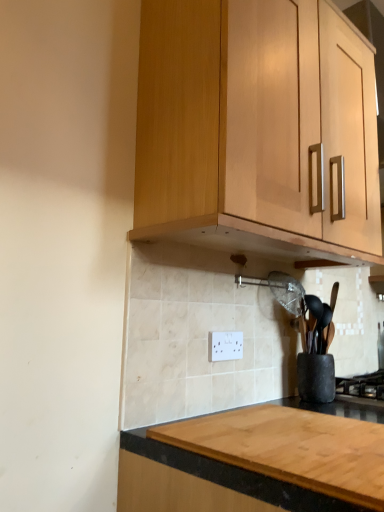
Question: Is light wood cabinet at upper center beside white plastic electric outlet at center?

Choices:
 (A) no
 (B) yes

Answer: (A)

Question: Is light wood cabinet at upper center aimed at white plastic electric outlet at center?

Choices:
 (A) no
 (B) yes

Answer: (A)

Question: Is light wood cabinet at upper center facing away from white plastic electric outlet at center?

Choices:
 (A) yes
 (B) no

Answer: (B)

Question: From a real-world perspective, does light wood cabinet at upper center sit lower than white plastic electric outlet at center?

Choices:
 (A) no
 (B) yes

Answer: (A)

Question: Considering the relative sizes of light wood cabinet at upper center and white plastic electric outlet at center in the image provided, is light wood cabinet at upper center wider than white plastic electric outlet at center?

Choices:
 (A) no
 (B) yes

Answer: (B)

Question: Is light wood cabinet at upper center positioned in front of white plastic electric outlet at center?

Choices:
 (A) yes
 (B) no

Answer: (A)

Question: Can you confirm if black granite countertop at lower center is shorter than light wood cabinet at upper center?

Choices:
 (A) yes
 (B) no

Answer: (A)

Question: Is black granite countertop at lower center to the right of light wood cabinet at upper center from the viewer's perspective?

Choices:
 (A) yes
 (B) no

Answer: (A)

Question: Is black granite countertop at lower center at the left side of light wood cabinet at upper center?

Choices:
 (A) no
 (B) yes

Answer: (A)

Question: Could you tell me if black granite countertop at lower center is facing light wood cabinet at upper center?

Choices:
 (A) no
 (B) yes

Answer: (A)

Question: From the image's perspective, is black granite countertop at lower center above light wood cabinet at upper center?

Choices:
 (A) no
 (B) yes

Answer: (A)

Question: Can you confirm if black granite countertop at lower center is wider than light wood cabinet at upper center?

Choices:
 (A) no
 (B) yes

Answer: (B)

Question: From a real-world perspective, is white plastic electric outlet at center located higher than black matte gas stove at lower right?

Choices:
 (A) no
 (B) yes

Answer: (B)